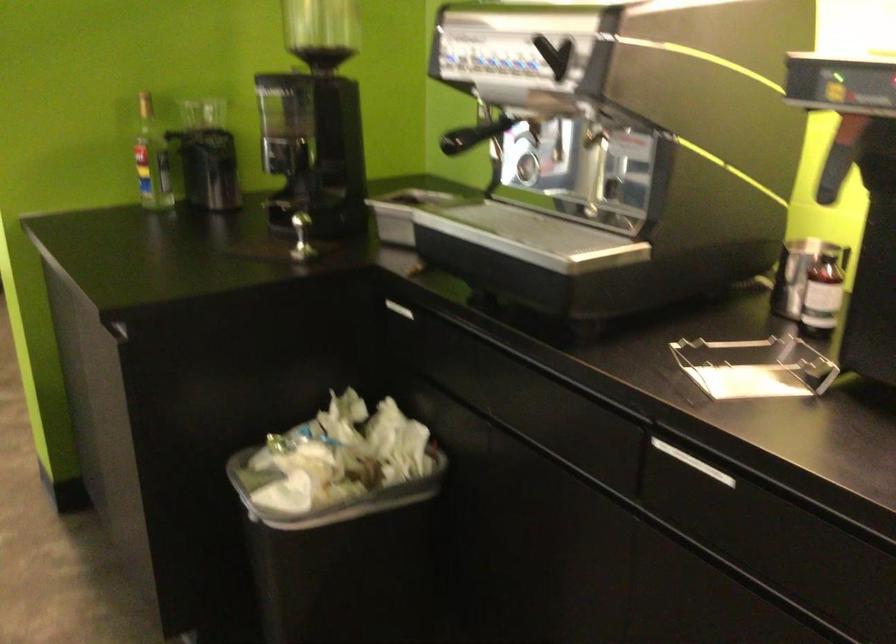
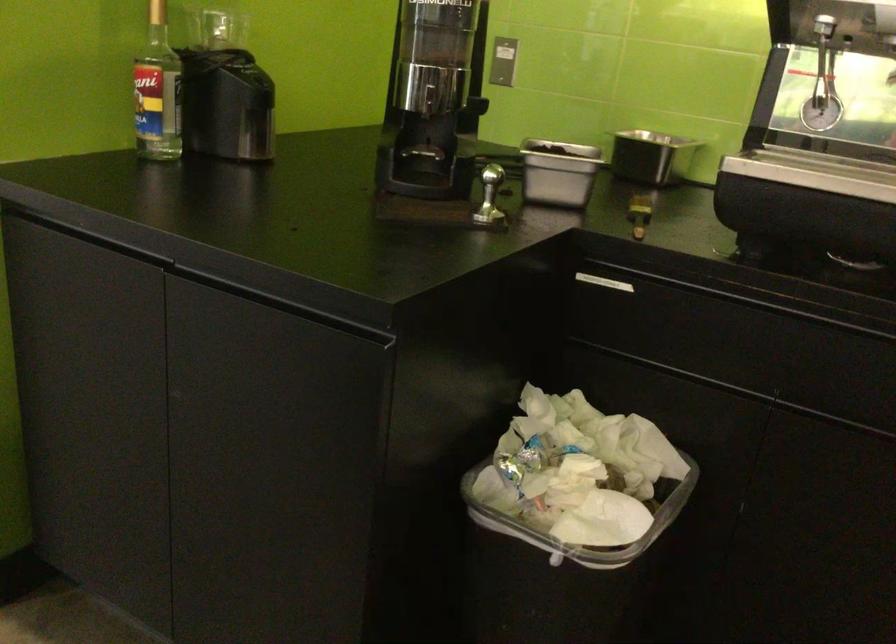
Locate, in the second image, the point that corresponds to point (279, 165) in the first image.

(433, 100)